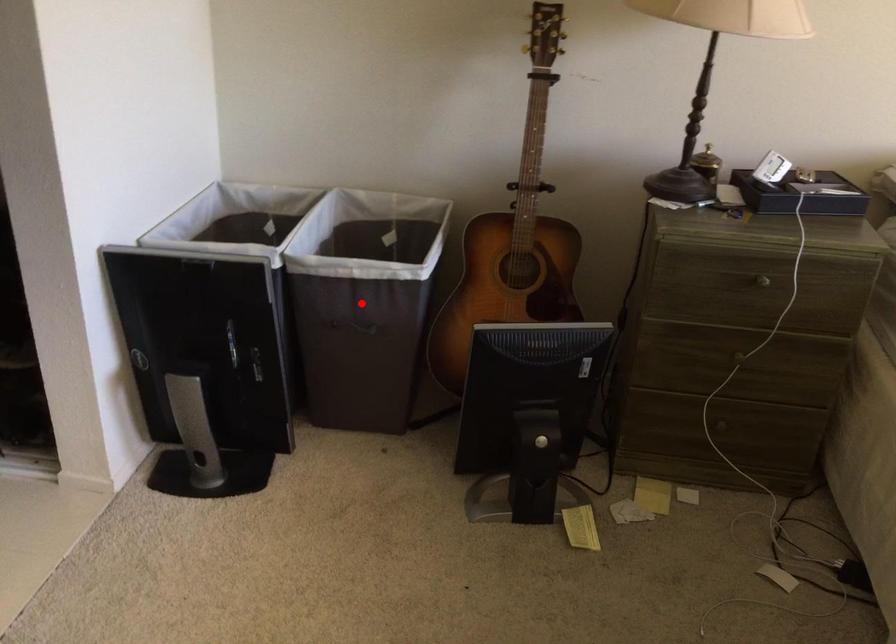
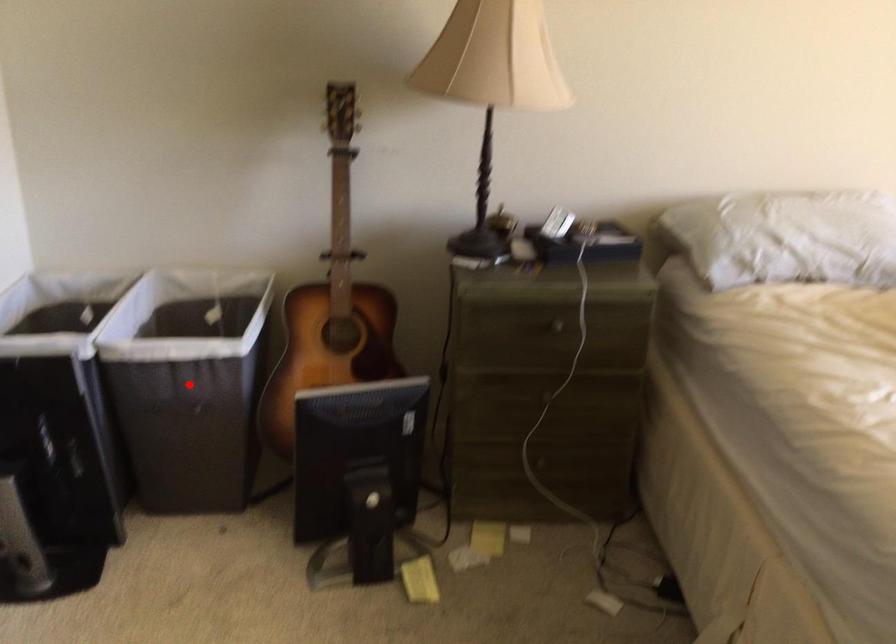
I am providing you with two images of the same scene from different viewpoints. A red point is marked on the first image and another point is marked on the second image. Is the red point in image1 aligned with the point shown in image2?

Yes